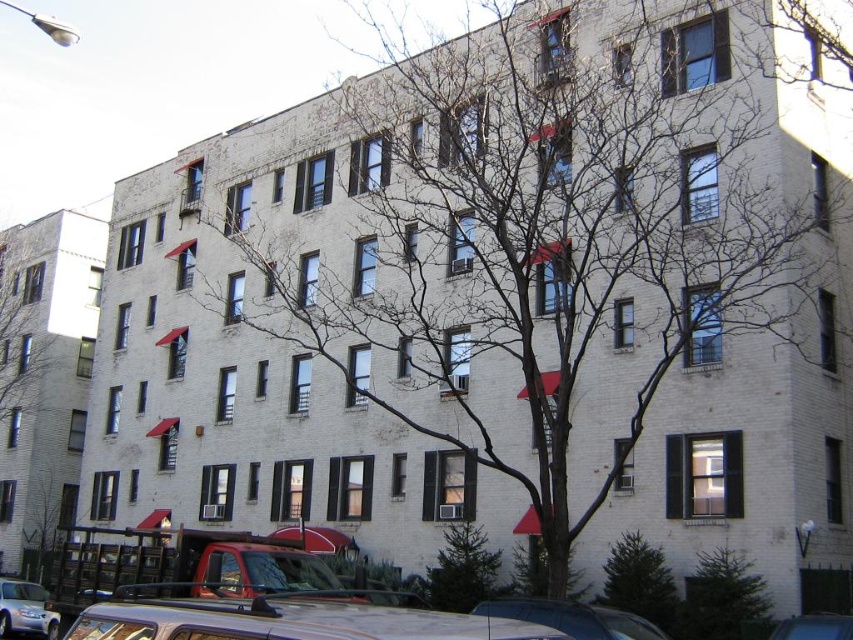
Between white matte van at lower center and metallic blue car at lower right, which one has more height?

white matte van at lower center is taller.

Who is positioned more to the left, white matte van at lower center or metallic blue car at lower right?

white matte van at lower center is more to the left.

Locate an element on the screen. white matte van at lower center is located at coordinates (289, 621).

Who is positioned more to the left, green textured evergreen tree at lower right or metallic silver car at lower center?

From the viewer's perspective, metallic silver car at lower center appears more on the left side.

The width and height of the screenshot is (853, 640). I want to click on green textured evergreen tree at lower right, so click(x=721, y=596).

Does point (712, 592) lie in front of point (619, 618)?

No, (712, 592) is further to viewer.

Identify the location of green textured evergreen tree at lower right. (721, 596).

Can you confirm if metallic silver car at lower center is positioned below satin silver car at lower left?

No, metallic silver car at lower center is not below satin silver car at lower left.

Is point (492, 600) positioned behind point (32, 620)?

No.

Measure the distance between metallic silver car at lower center and camera.

A distance of 106.54 feet exists between metallic silver car at lower center and camera.

The height and width of the screenshot is (640, 853). Find the location of `metallic silver car at lower center`. metallic silver car at lower center is located at coordinates (572, 618).